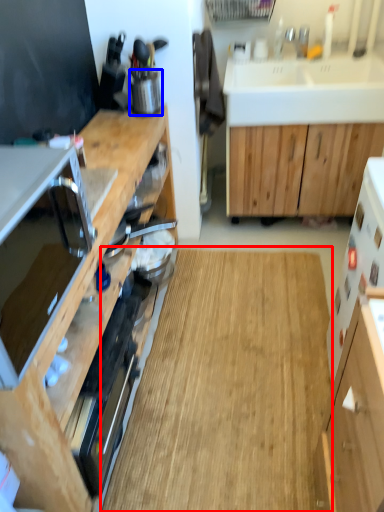
Question: Which of the following is the farthest to the observer, hardwood (highlighted by a red box) or appliance (highlighted by a blue box)?

Choices:
 (A) hardwood
 (B) appliance

Answer: (B)